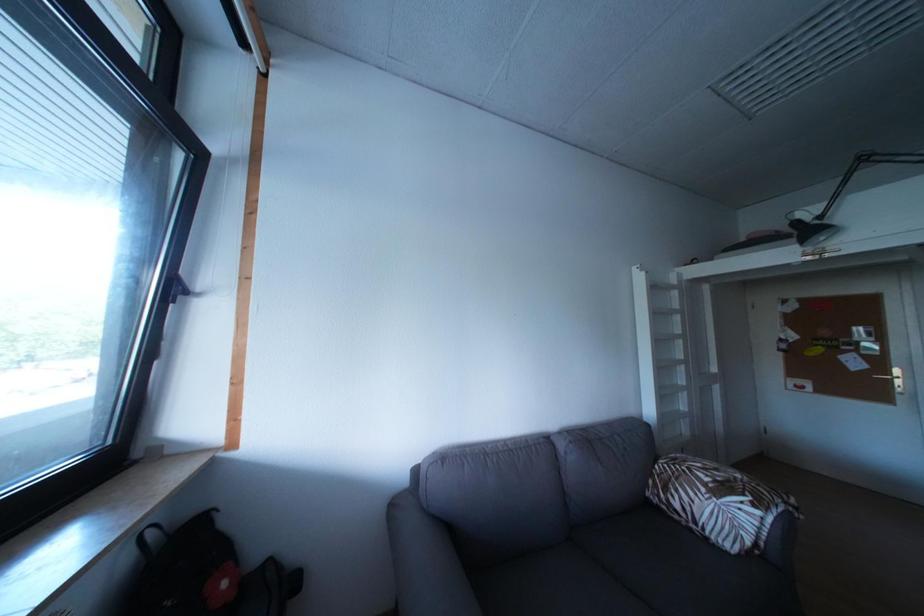
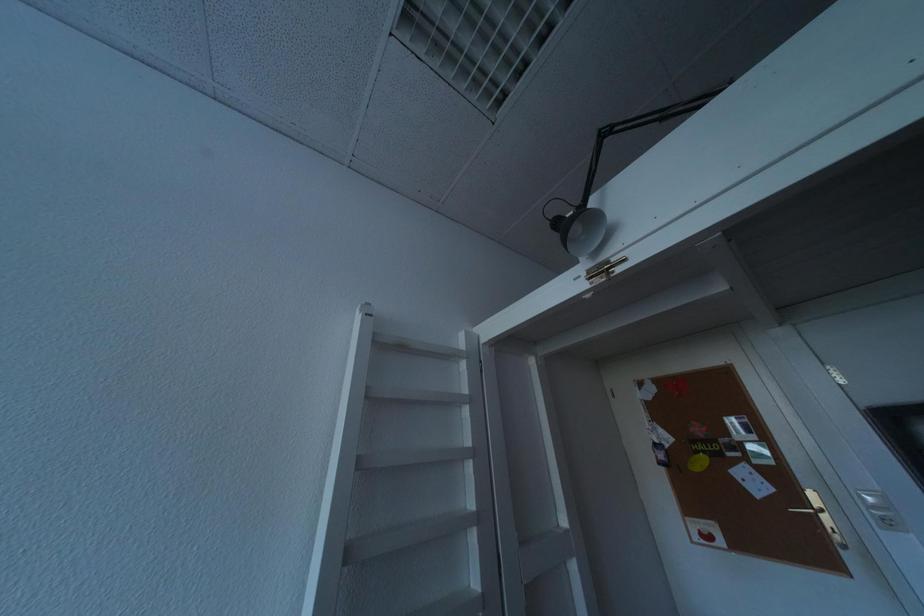
In a continuous first-person perspective shot, in which direction is the camera moving?

The movement direction of the cameraman is right, forward.